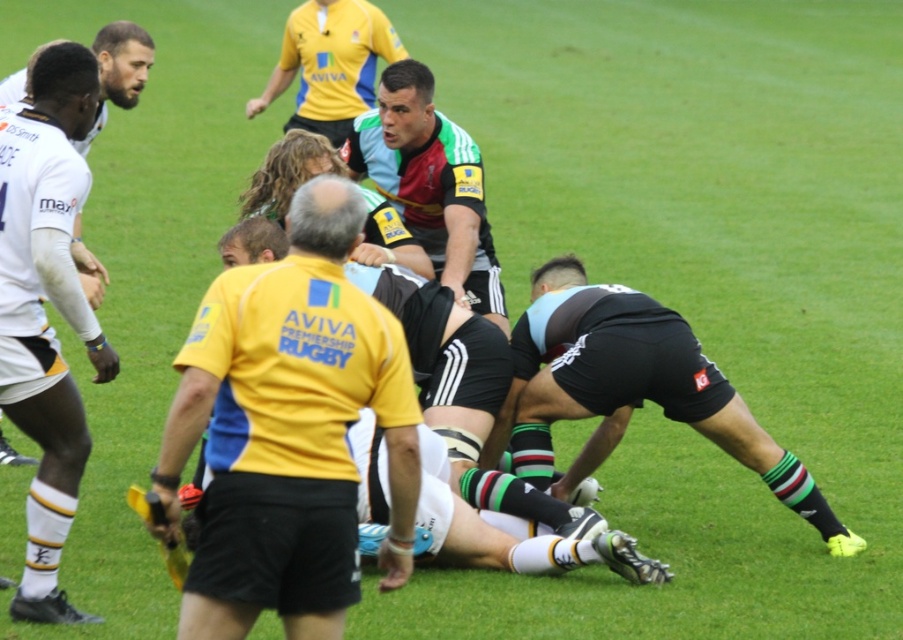
Describe the element at coordinates (630, 390) in the screenshot. This screenshot has height=640, width=903. I see `black jersey at center` at that location.

Describe the element at coordinates (630, 390) in the screenshot. I see `black jersey at center` at that location.

I want to click on black jersey at center, so click(630, 390).

Between point (592, 412) and point (321, 115), which one is positioned in front?

Point (592, 412) is in front.

The width and height of the screenshot is (903, 640). Describe the element at coordinates (630, 390) in the screenshot. I see `black jersey at center` at that location.

At what (x,y) coordinates should I click in order to perform the action: click on black jersey at center. Please return your answer as a coordinate pair (x, y). Looking at the image, I should click on (630, 390).

Which is more to the right, black jersey at center or maroon jersey at center?

black jersey at center is more to the right.

Does point (538, 406) come farther from viewer compared to point (399, 136)?

No, (538, 406) is in front of (399, 136).

Find the location of a particular element. The height and width of the screenshot is (640, 903). black jersey at center is located at coordinates (630, 390).